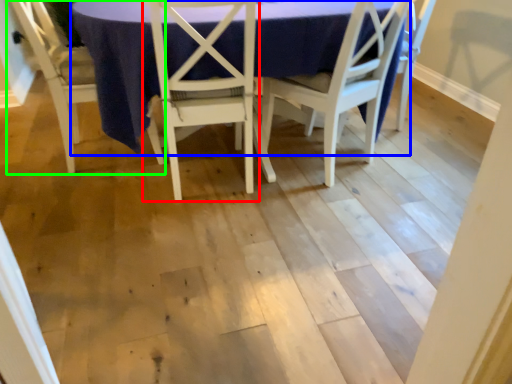
Question: Which is nearer to the chair (highlighted by a red box)? round table (highlighted by a blue box) or chair (highlighted by a green box).

Choices:
 (A) round table
 (B) chair

Answer: (A)